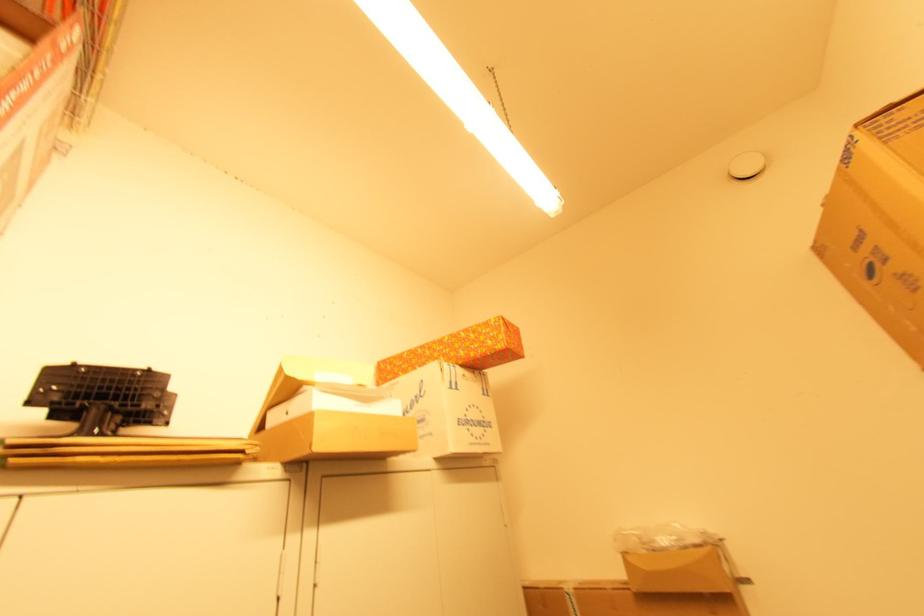
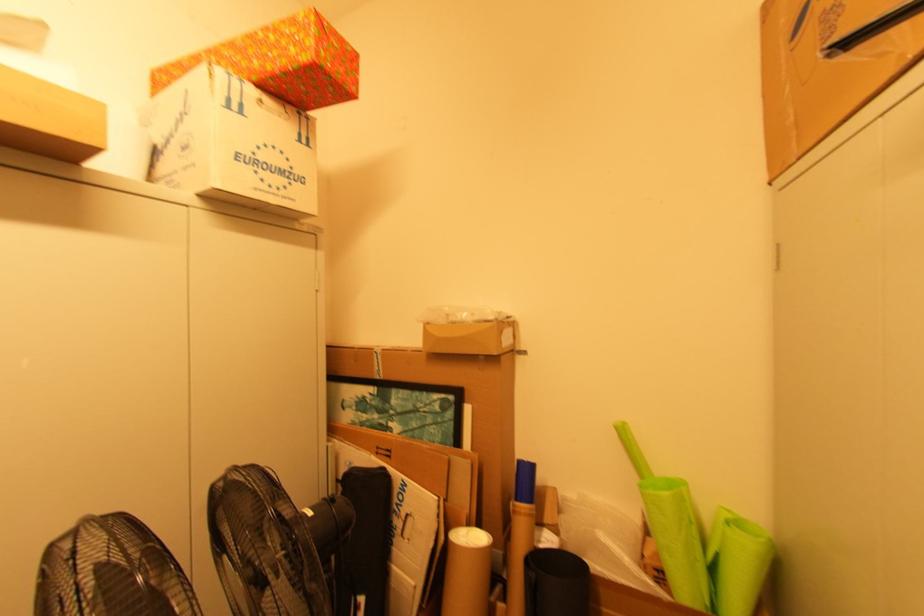
The point at (465, 353) is marked in the first image. Where is the corresponding point in the second image?

(258, 63)